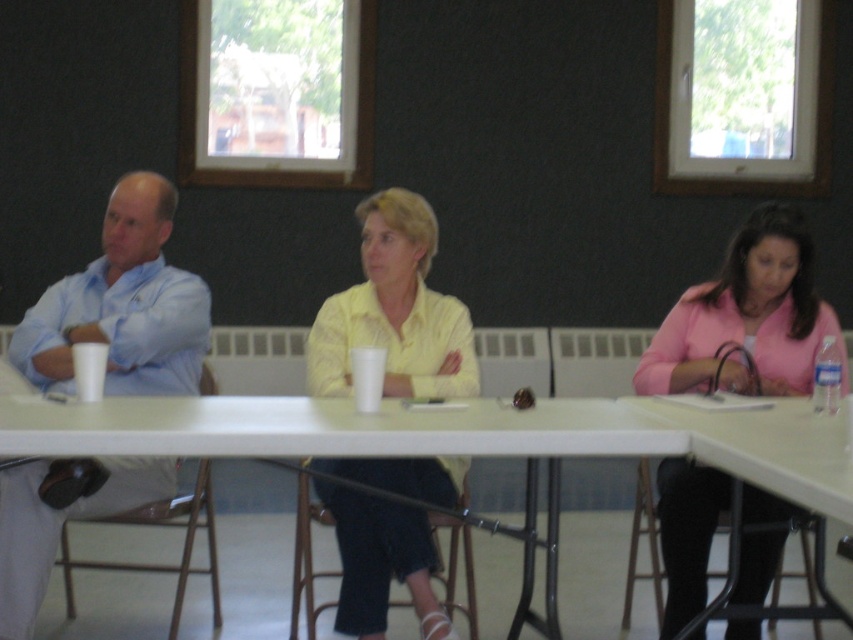
Locate an element on the screen. The image size is (853, 640). pink matte jacket at lower right is located at coordinates (746, 317).

Between pink matte jacket at lower right and white plastic table at center, which one has more height?

pink matte jacket at lower right

You are a GUI agent. You are given a task and a screenshot of the screen. Output one action in this format:
    pyautogui.click(x=<x>, y=<y>)
    Task: Click on the pink matte jacket at lower right
    The width and height of the screenshot is (853, 640).
    Given the screenshot: What is the action you would take?
    pyautogui.click(x=746, y=317)

Is light blue shirt at left to the right of white plastic table at center from the viewer's perspective?

No, light blue shirt at left is not to the right of white plastic table at center.

Does light blue shirt at left have a smaller size compared to white plastic table at center?

Indeed, light blue shirt at left has a smaller size compared to white plastic table at center.

Which is in front, point (137, 179) or point (10, 422)?

Point (10, 422) is more forward.

The image size is (853, 640). I want to click on light blue shirt at left, so click(122, 305).

Does light blue shirt at left have a lesser height compared to pink matte jacket at lower right?

Yes.

How distant is light blue shirt at left from pink matte jacket at lower right?

A distance of 5.22 feet exists between light blue shirt at left and pink matte jacket at lower right.

Between point (172, 384) and point (660, 632), which one is positioned behind?

Point (172, 384)

The height and width of the screenshot is (640, 853). I want to click on light blue shirt at left, so click(122, 305).